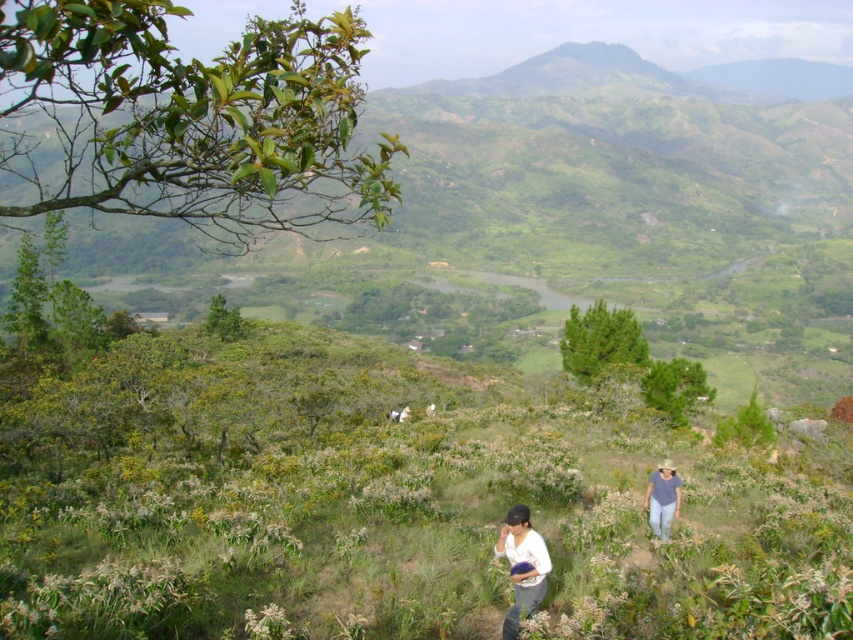
Looking at this image, you are a photographer trying to capture a group photo of the white matte shirt at lower center and the denim shirt at lower right. Since you want both to appear equally sized in the photo, which person should you move closer to the camera and which should move farther away?

The denim shirt at lower right should move closer to the camera, and the white matte shirt at lower center should move farther away. Since the white matte shirt at lower center is already larger, moving it back will reduce its apparent size, while bringing the smaller denim shirt at lower right forward will make it appear bigger, balancing their sizes in the photo.